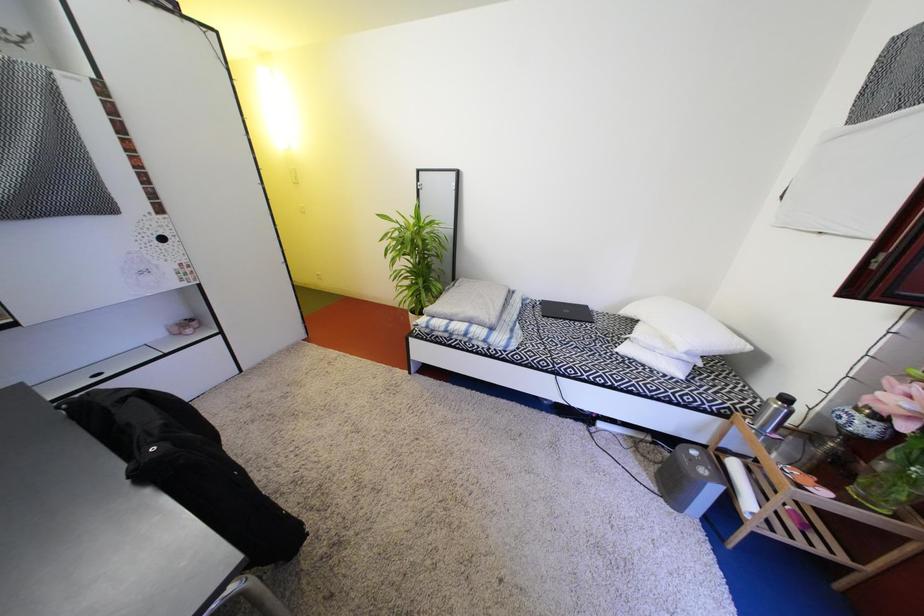
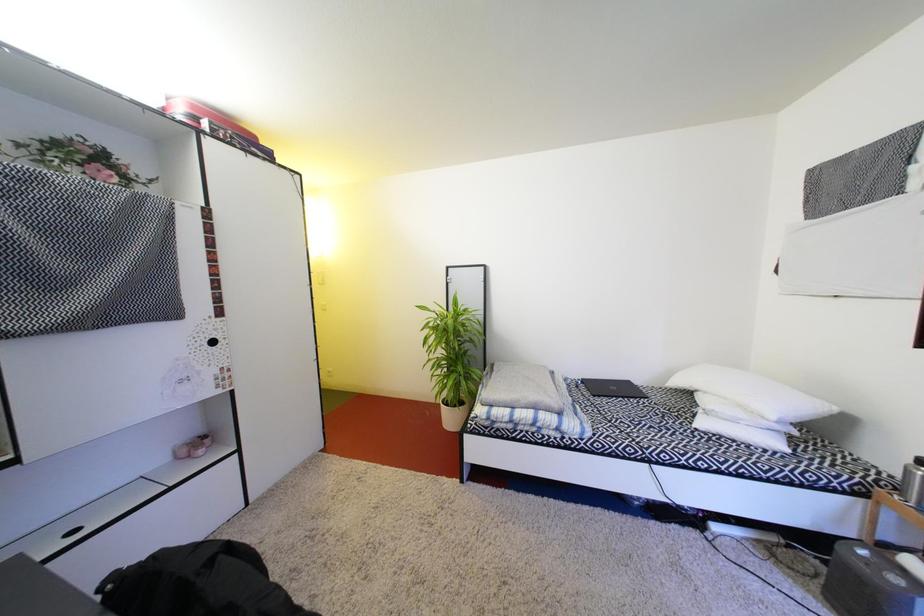
Question: How did the camera likely rotate?

Choices:
 (A) Left
 (B) Right
 (C) Up
 (D) Down

Answer: (C)